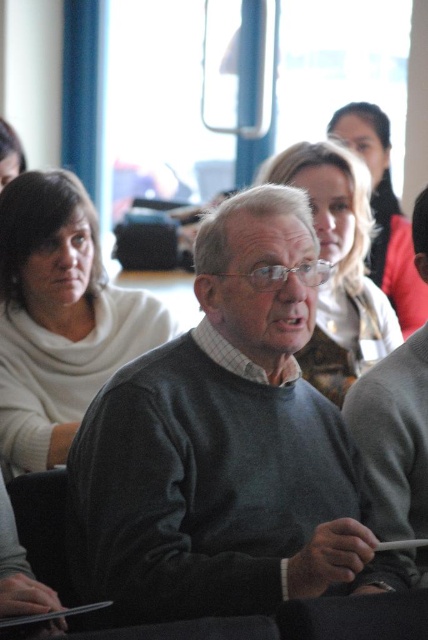
Does dark gray sweater at center have a lesser height compared to smooth beige sweater at center?

Yes.

Who is higher up, dark gray sweater at center or smooth beige sweater at center?

smooth beige sweater at center is above.

The width and height of the screenshot is (428, 640). In order to click on dark gray sweater at center in this screenshot , I will do `click(225, 445)`.

The image size is (428, 640). What are the coordinates of `dark gray sweater at center` in the screenshot? It's located at (225, 445).

Is matte beige sweater at center to the left of smooth beige sweater at center from the viewer's perspective?

Correct, you'll find matte beige sweater at center to the left of smooth beige sweater at center.

Between matte beige sweater at center and smooth beige sweater at center, which one appears on the right side from the viewer's perspective?

smooth beige sweater at center

Identify the location of matte beige sweater at center. The width and height of the screenshot is (428, 640). (338, 266).

I want to click on matte beige sweater at center, so click(338, 266).

Locate an element on the screen. The height and width of the screenshot is (640, 428). dark gray sweater at center is located at coordinates (225, 445).

Can you confirm if dark gray sweater at center is positioned above white sweater at left?

No.

Who is more distant from viewer, (300, 488) or (38, 428)?

Positioned behind is point (38, 428).

In order to click on dark gray sweater at center in this screenshot , I will do `click(225, 445)`.